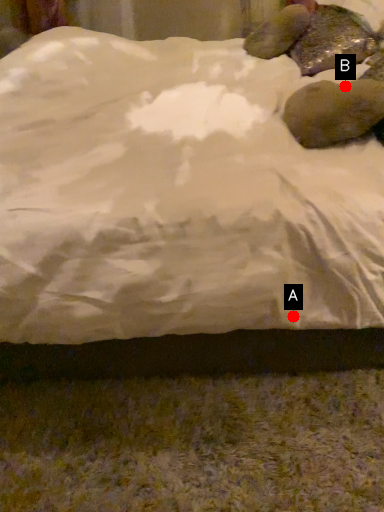
Question: Two points are circled on the image, labeled by A and B beside each circle. Which point appears closest to the camera in this image?

Choices:
 (A) A is closer
 (B) B is closer

Answer: (A)